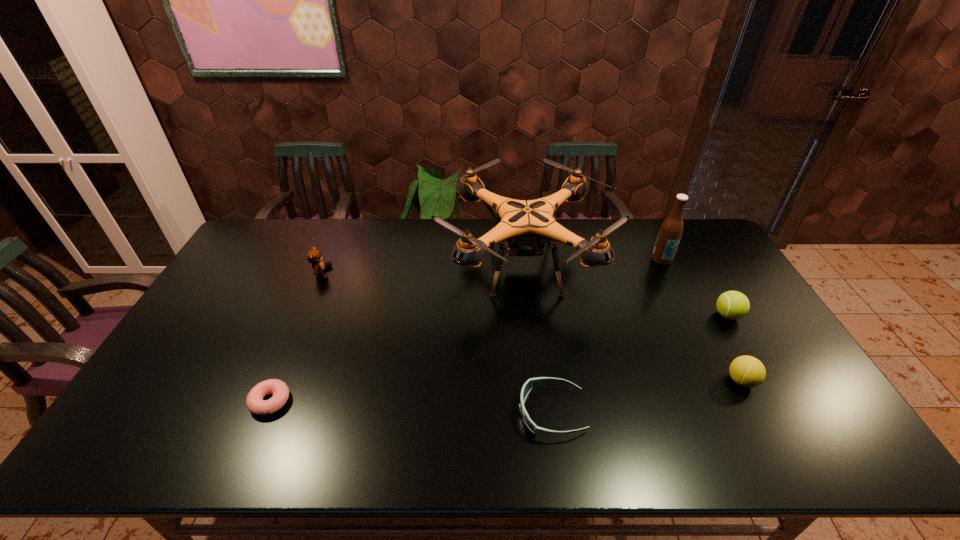
This screenshot has height=540, width=960. Identify the location of vacant space located 0.100m on the right of the beer bottle. (701, 259).

Locate an element on the screen. This screenshot has width=960, height=540. vacant space located on the front-facing side of the teddy bear is located at coordinates (346, 272).

This screenshot has width=960, height=540. Find the location of `vacant space located 0.170m on the back of the farther tennis ball`. vacant space located 0.170m on the back of the farther tennis ball is located at coordinates (701, 270).

Identify the location of free space located 0.120m on the right of the nearer tennis ball. (803, 381).

At what (x,y) coordinates should I click in order to perform the action: click on vacant space located 0.140m on the front-facing side of the sixth tallest object. Please return your answer as a coordinate pair (x, y). The image size is (960, 540). Looking at the image, I should click on (462, 411).

At what (x,y) coordinates should I click in order to perform the action: click on vacant space situated 0.270m on the front-facing side of the sixth tallest object. Please return your answer as a coordinate pair (x, y). Looking at the image, I should click on (409, 411).

You are a GUI agent. You are given a task and a screenshot of the screen. Output one action in this format:
    pyautogui.click(x=<x>, y=<y>)
    Task: Click on the free space located on the front-facing side of the sixth tallest object
    
    Given the screenshot: What is the action you would take?
    pyautogui.click(x=434, y=411)

What are the coordinates of `free space located on the back of the shortest object` in the screenshot? It's located at (300, 330).

Locate an element on the screen. This screenshot has width=960, height=540. drone that is at the far edge is located at coordinates (522, 227).

Locate an element on the screen. The height and width of the screenshot is (540, 960). beer bottle present at the far edge is located at coordinates pos(671,230).